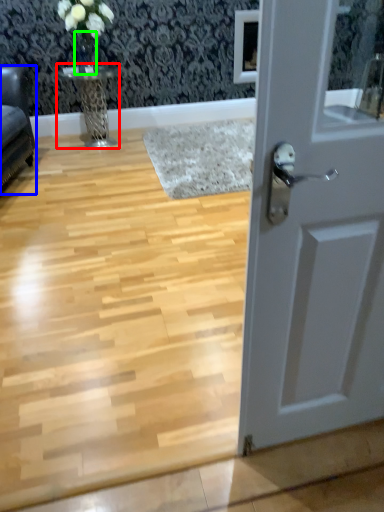
Question: Which object is positioned farthest from table (highlighted by a red box)? Select from furniture (highlighted by a blue box) and glass vase (highlighted by a green box).

Choices:
 (A) furniture
 (B) glass vase

Answer: (A)